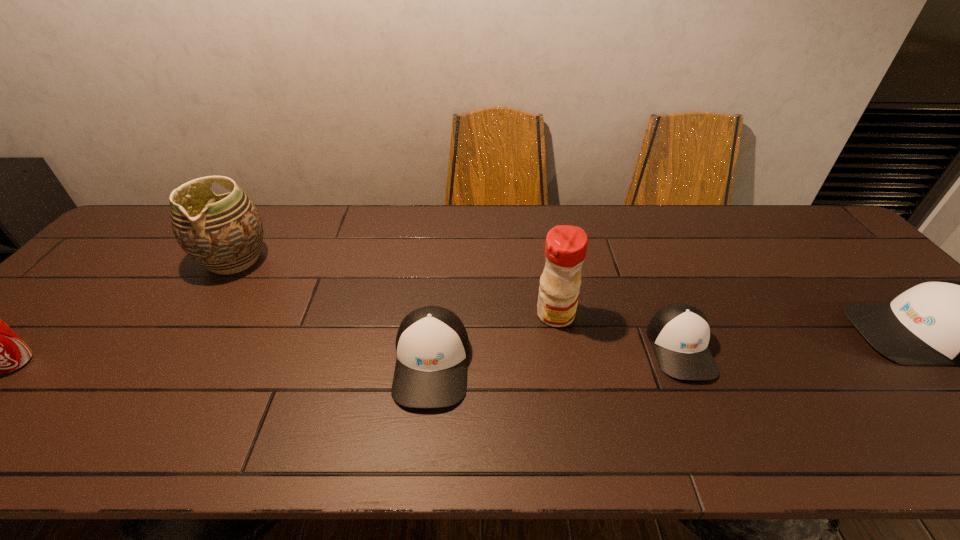
Considering the uniform spacing of caps, where should an additional cap be positioned on the left? Please locate a free spot. Please provide its 2D coordinates. Your answer should be formatted as a tuple, i.e. [(x, y)], where the tuple contains the x and y coordinates of a point satisfying the conditions above.

[(166, 381)]